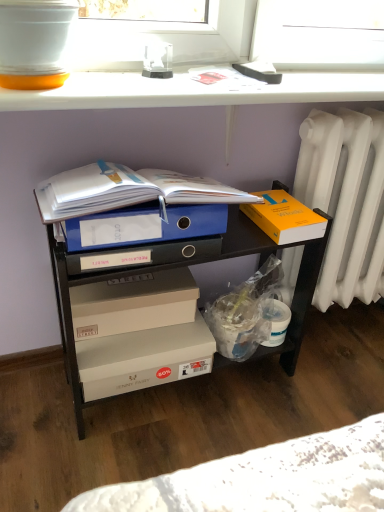
You are a GUI agent. You are given a task and a screenshot of the screen. Output one action in this format:
    pyautogui.click(x=<x>, y=<y>)
    Task: Click on the vacant area that is in front of blue plastic file at center
    
    Given the screenshot: What is the action you would take?
    pyautogui.click(x=151, y=451)